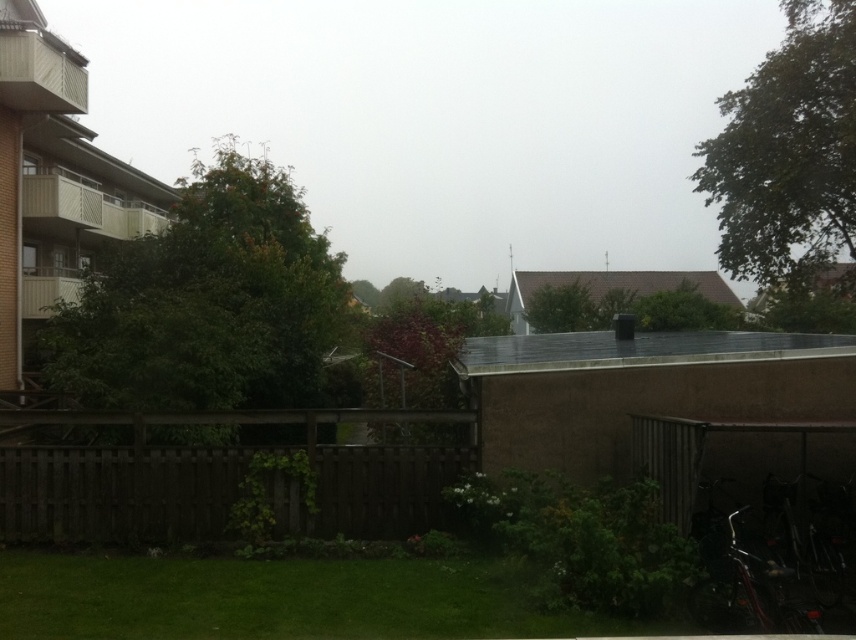
You are a drone operator trying to capture a clear aerial shot of the brown wooden fence at lower left and the transparent fog at upper center. Based on their relative heights, which object will appear larger in the photo?

The transparent fog at upper center will appear larger in the photo because it is taller than the brown wooden fence at lower left.

You are standing in the residential outdoor scene and want to take a photo. You have two points marked in the image, point (580, 86) and point (126, 499). Which point is closer to your camera?

Point (126, 499) is closer to the camera because it is less further than point (580, 86).